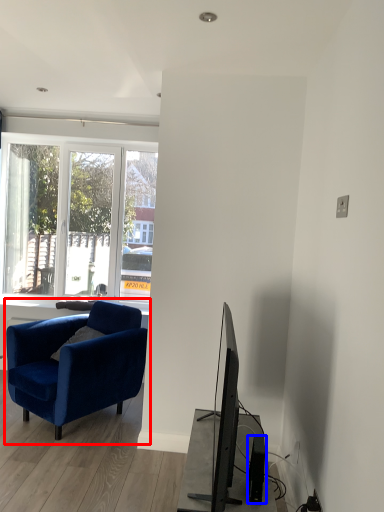
Question: Which object appears closest to the camera in this image, chair (highlighted by a red box) or speaker (highlighted by a blue box)?

Choices:
 (A) chair
 (B) speaker

Answer: (B)